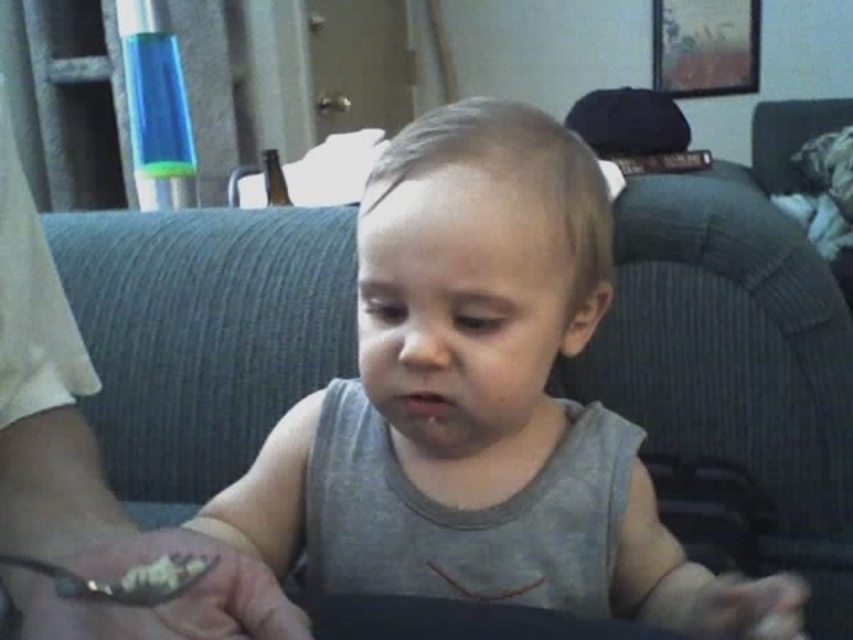
You are a photographer taking a picture of the baby on the couch. You notice two points in the image labeled as point 1 at coordinates point (505, 461) and point 2 at coordinates point (161, 570). Which point is closer to you, the photographer?

Point (505, 461) is closer to you than point (161, 570) because it is further to the viewer in the image.

You are a photographer trying to capture a close shot of the baby on the couch. You want to focus on the baby but need to ensure the spoon in the lower left corner is still in the frame. Given that the point representing the spoon is located at coordinates point [561,353], which is 62.80 centimeters away from the camera, can you estimate if adjusting your camera position by moving it 10 centimeters closer to the baby will keep the spoon within the frame?

The point [561,353] is 62.80 centimeters away from the camera. Moving the camera 10 centimeters closer would place it at 52.80 centimeters from the original position. Since the spoon is part of the scene and its position relative to the baby hasn not changed, adjusting the camera closer won t cause the spoon to move out of frame. The spoon will remain visible as long as the camera s field of view still includes the lower left corner where the spoon is located.